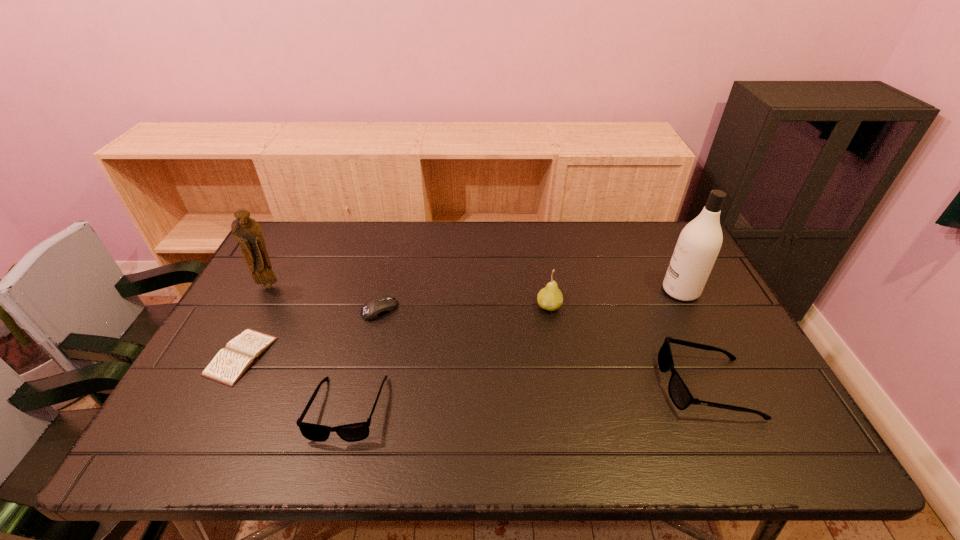
Locate an element on the screen. The width and height of the screenshot is (960, 540). vacant position located on the front-facing side of the fourth shortest object is located at coordinates (516, 386).

Identify the location of free space located on the front-facing side of the fourth shortest object. (540, 386).

Where is `free space located 0.110m on the front-facing side of the fourth shortest object`? Image resolution: width=960 pixels, height=540 pixels. free space located 0.110m on the front-facing side of the fourth shortest object is located at coordinates (618, 386).

This screenshot has height=540, width=960. I want to click on vacant point located 0.210m on the front-facing side of the figurine, so [x=238, y=343].

The width and height of the screenshot is (960, 540). I want to click on vacant region located on the back of the fifth shortest object, so click(544, 279).

Locate an element on the screen. This screenshot has width=960, height=540. vacant space located 0.270m on the left of the second shortest object is located at coordinates tap(269, 309).

This screenshot has height=540, width=960. Identify the location of vacant space located 0.050m on the front-facing side of the shampoo. (646, 291).

Where is `free space located on the front-facing side of the shampoo`? free space located on the front-facing side of the shampoo is located at coordinates (560, 291).

What are the coordinates of `vacant point located 0.260m on the front-facing side of the shampoo` in the screenshot? It's located at (576, 291).

This screenshot has height=540, width=960. Find the location of `vacant space located on the front of the shortest object`. vacant space located on the front of the shortest object is located at coordinates (210, 416).